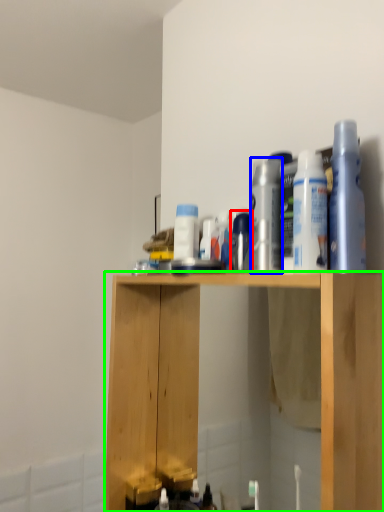
Question: Which is nearer to the toiletry (highlighted by a red box)? cleaning product (highlighted by a blue box) or cabinetry (highlighted by a green box).

Choices:
 (A) cleaning product
 (B) cabinetry

Answer: (A)